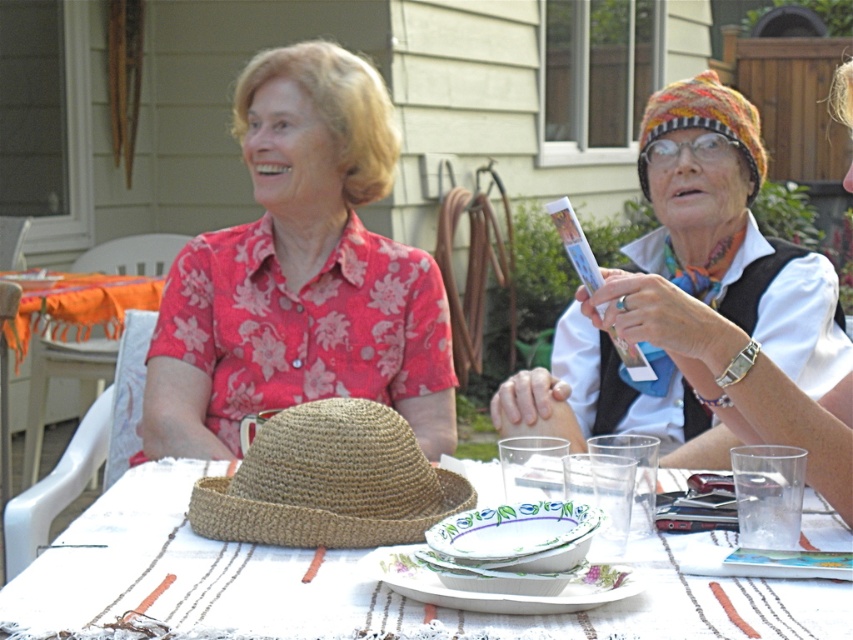
Is point (392, 401) positioned after point (267, 464)?

Yes, point (392, 401) is behind point (267, 464).

The width and height of the screenshot is (853, 640). Describe the element at coordinates (300, 273) in the screenshot. I see `floral cotton shirt at center` at that location.

Identify the location of floral cotton shirt at center. (300, 273).

Looking at this image, which is below, brown woven straw hat at center or white plastic picnic table at lower left?

brown woven straw hat at center is lower down.

This screenshot has height=640, width=853. In order to click on brown woven straw hat at center in this screenshot , I will do `click(329, 481)`.

In order to click on brown woven straw hat at center in this screenshot , I will do `click(329, 481)`.

Who is positioned more to the left, knitted woolen hat at upper right or brown woven straw hat at center?

Positioned to the left is brown woven straw hat at center.

Between knitted woolen hat at upper right and brown woven straw hat at center, which one has less height?

With less height is brown woven straw hat at center.

Is point (747, 294) behind point (300, 432)?

Yes, point (747, 294) is behind point (300, 432).

Find the location of a particular element. knitted woolen hat at upper right is located at coordinates (732, 230).